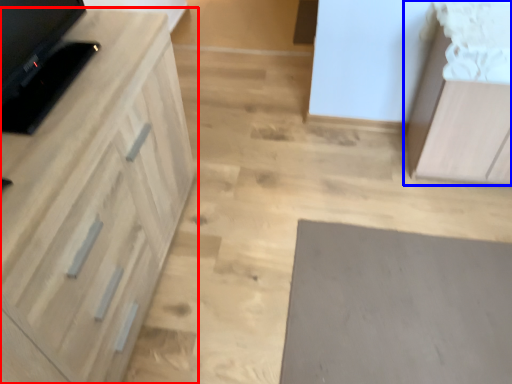
Question: Which object is closer to the camera taking this photo, cabinetry (highlighted by a red box) or cabinetry (highlighted by a blue box)?

Choices:
 (A) cabinetry
 (B) cabinetry

Answer: (A)